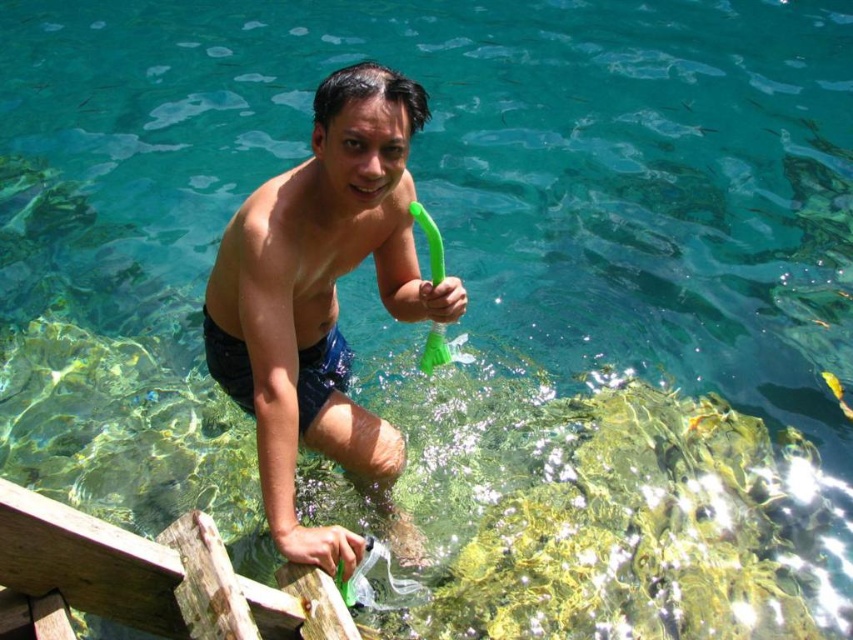
You are a fashion designer observing the image and need to determine which shorts are more suitable for a beach outfit. Based on the size difference between the shiny blue shorts at center and the dark blue fabric shorts at center, which pair would you recommend?

The shiny blue shorts at center is bigger than the dark blue fabric shorts at center, so the shiny blue shorts at center would be more suitable for a beach outfit as they provide more coverage and comfort in the water.

You are a fashion designer observing a model wearing shiny blue shorts at center and dark blue fabric shorts at center. You need to determine if the two shorts can be displayed side by side in a store window that is 16 inches wide. Can they fit without overlapping?

The distance between shiny blue shorts at center and dark blue fabric shorts at center is 15.74 inches, which is less than the 16 inches width of the store window. Therefore, they can fit side by side without overlapping.